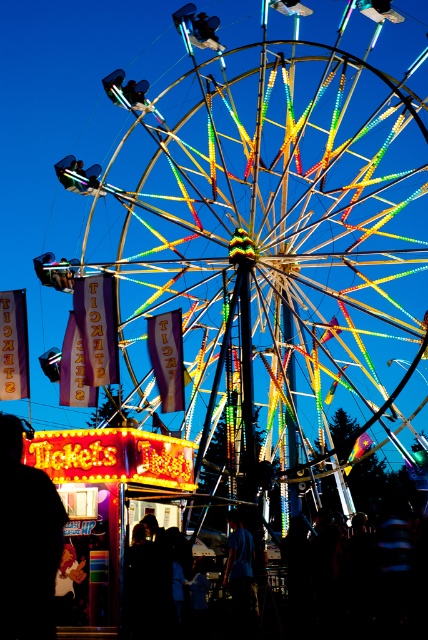
Looking at this image, you are a photographer standing at the fairground and want to take a photo of the blue fabric shirt at center and the metallic silver helmet at center. Which object should you focus on first if you want to capture both in the same frame without moving the camera?

The blue fabric shirt at center is positioned on the right side of metallic silver helmet at center, so you should focus on the metallic silver helmet at center first to ensure both objects are in the frame.

You are standing at the ticket booth and want to take a photo of the Ferris wheel. You have a camera in your hand. Is the blue fabric shirt at center within the camera lens range to capture the Ferris wheel?

The blue fabric shirt at center and camera are 321.35 feet apart from each other. Since the camera is in your hand, the shirt is too far away to be captured in the photo of the Ferris wheel.

You are standing at the fairground and see the Ferris wheel and the ticket booth. There is a specific point marked at coordinates point (71,589). If you want to walk towards the Ferris wheel, will you pass through this point first before reaching the ticket booth?

The distance of point (71,589) from viewer is 101.06 meters, so if the ticket booth is closer than 101.06 meters, you would reach it first. However, if the ticket booth is farther away, you would pass through the point before reaching it. Without knowing the ticket booth distance, the answer cannot be determined.